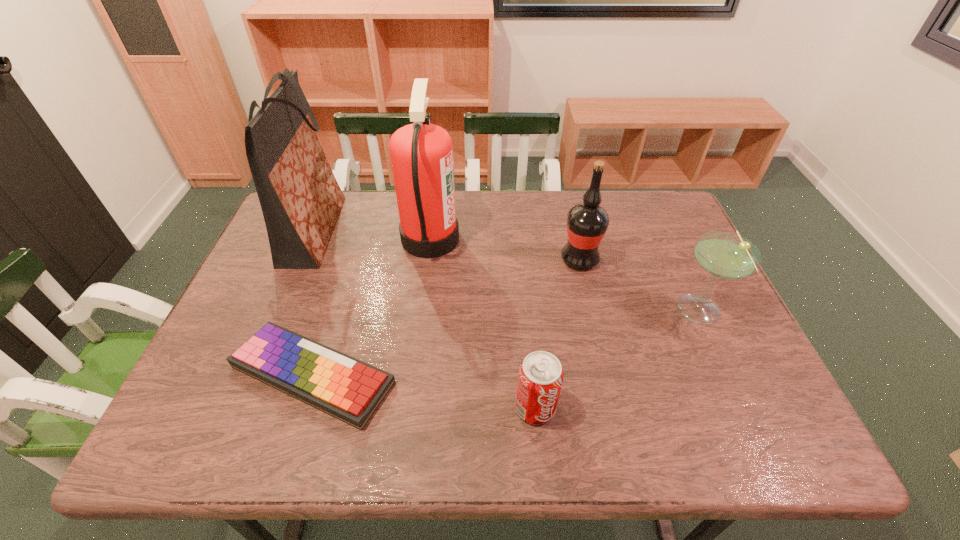
What are the coordinates of `shopping bag` in the screenshot? It's located at coord(300,198).

Identify the location of fire extinguisher. Image resolution: width=960 pixels, height=540 pixels. (421, 154).

Locate an element on the screen. This screenshot has height=540, width=960. wine bottle is located at coordinates (x=587, y=222).

The image size is (960, 540). I want to click on the third tallest object, so click(x=587, y=222).

Image resolution: width=960 pixels, height=540 pixels. In order to click on the rightmost object in this screenshot , I will do `click(725, 255)`.

This screenshot has width=960, height=540. Find the location of `martini`. martini is located at coordinates (725, 255).

The height and width of the screenshot is (540, 960). I want to click on the second shortest object, so click(540, 377).

At what (x,y) coordinates should I click in order to perform the action: click on the third object from right to left. Please return your answer as a coordinate pair (x, y). The height and width of the screenshot is (540, 960). Looking at the image, I should click on (540, 377).

In order to click on computer keyboard in this screenshot , I will do `click(350, 390)`.

The width and height of the screenshot is (960, 540). In order to click on vacant region located 0.220m on the front-facing side of the shopping bag in this screenshot , I will do `click(417, 231)`.